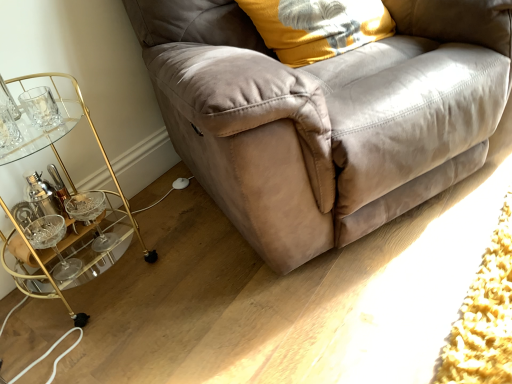
Question: Should I look upward or downward to see soft yellow fabric pillow at upper right?

Choices:
 (A) down
 (B) up

Answer: (B)

Question: From a real-world perspective, is gold metallic bar cart at left physically below suede couch at center?

Choices:
 (A) no
 (B) yes

Answer: (B)

Question: Is gold metallic bar cart at left to the right of suede couch at center from the viewer's perspective?

Choices:
 (A) no
 (B) yes

Answer: (A)

Question: Is gold metallic bar cart at left next to suede couch at center and touching it?

Choices:
 (A) yes
 (B) no

Answer: (B)

Question: Is gold metallic bar cart at left smaller than suede couch at center?

Choices:
 (A) yes
 (B) no

Answer: (A)

Question: Is gold metallic bar cart at left positioned in front of suede couch at center?

Choices:
 (A) yes
 (B) no

Answer: (B)

Question: Is gold metallic bar cart at left oriented towards suede couch at center?

Choices:
 (A) no
 (B) yes

Answer: (A)

Question: Is suede couch at center aimed at gold metallic bar cart at left?

Choices:
 (A) no
 (B) yes

Answer: (A)

Question: Is suede couch at center touching gold metallic bar cart at left?

Choices:
 (A) no
 (B) yes

Answer: (A)

Question: Is suede couch at center positioned with its back to gold metallic bar cart at left?

Choices:
 (A) no
 (B) yes

Answer: (A)

Question: Can you confirm if suede couch at center is taller than gold metallic bar cart at left?

Choices:
 (A) no
 (B) yes

Answer: (B)

Question: Would you say suede couch at center is outside gold metallic bar cart at left?

Choices:
 (A) no
 (B) yes

Answer: (B)

Question: Does suede couch at center lie behind gold metallic bar cart at left?

Choices:
 (A) no
 (B) yes

Answer: (A)

Question: Is the depth of suede couch at center greater than that of soft yellow fabric pillow at upper right?

Choices:
 (A) no
 (B) yes

Answer: (A)